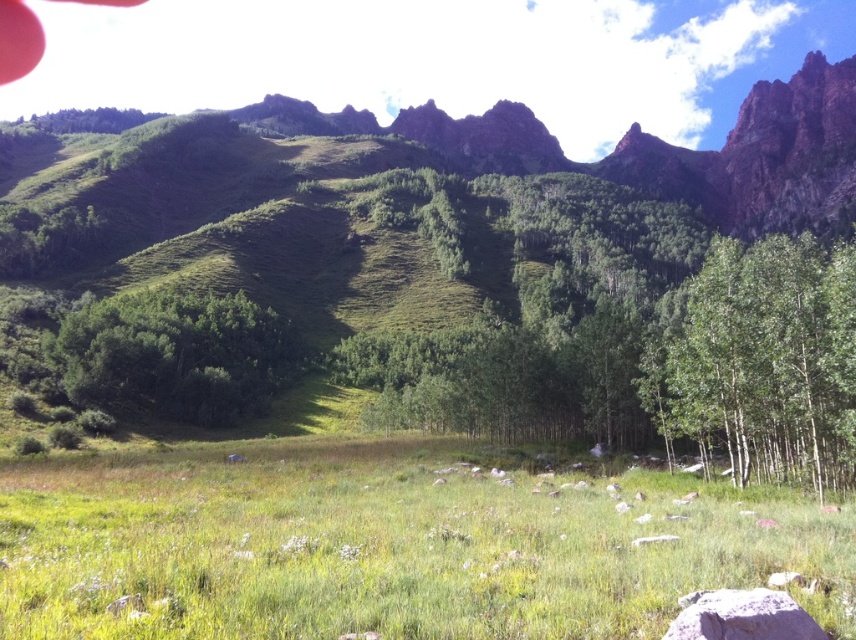
Consider the image. Can you confirm if green leafy tree at center is shorter than gray rock at lower center?

Incorrect, green leafy tree at center's height does not fall short of gray rock at lower center's.

Is green leafy tree at center bigger than gray rock at lower center?

Correct, green leafy tree at center is larger in size than gray rock at lower center.

Who is more distant from viewer, [271,342] or [694,632]?

Point [271,342]

This screenshot has width=856, height=640. Find the location of `green leafy tree at center`. green leafy tree at center is located at coordinates (175, 355).

Is green grassy field at center thinner than gray rock at lower center?

In fact, green grassy field at center might be wider than gray rock at lower center.

Does green grassy field at center have a smaller size compared to gray rock at lower center?

No.

At what (x,y) coordinates should I click in order to perform the action: click on green grassy field at center. Please return your answer as a coordinate pair (x, y). Image resolution: width=856 pixels, height=640 pixels. Looking at the image, I should click on (388, 547).

Where is `green matte tree at lower right`? green matte tree at lower right is located at coordinates (767, 360).

Can you confirm if green matte tree at lower right is positioned to the right of green leafy tree at center?

Indeed, green matte tree at lower right is positioned on the right side of green leafy tree at center.

Which is behind, point (711, 404) or point (134, 308)?

The point (134, 308) is behind.

Locate an element on the screen. green matte tree at lower right is located at coordinates (767, 360).